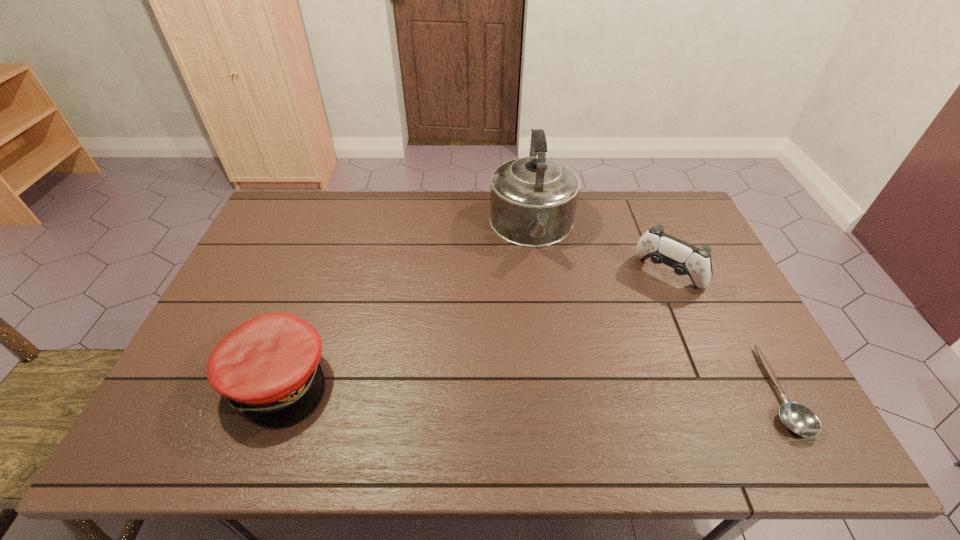
The height and width of the screenshot is (540, 960). What are the coordinates of `ladle at the right edge` in the screenshot? It's located at (799, 419).

Locate an element on the screen. The image size is (960, 540). control that is at the right edge is located at coordinates (686, 259).

At what (x,y) coordinates should I click in order to perform the action: click on object that is at the near left corner. Please return your answer as a coordinate pair (x, y). Looking at the image, I should click on (268, 367).

Identify the location of object that is at the near right corner. Image resolution: width=960 pixels, height=540 pixels. (799, 419).

This screenshot has height=540, width=960. Identify the location of vacant area at the far edge. (588, 195).

In the image, there is a desktop. Where is `free region at the near edge`? free region at the near edge is located at coordinates (589, 395).

Locate an element on the screen. The width and height of the screenshot is (960, 540). blank space at the left edge of the desktop is located at coordinates (270, 253).

The width and height of the screenshot is (960, 540). In the image, there is a desktop. In order to click on vacant space at the right edge in this screenshot , I will do `click(712, 255)`.

Find the location of a particular element. The width and height of the screenshot is (960, 540). free region at the far right corner of the desktop is located at coordinates (670, 230).

The image size is (960, 540). I want to click on free space that is in between the leftmost object and the second object from right to left, so click(x=473, y=327).